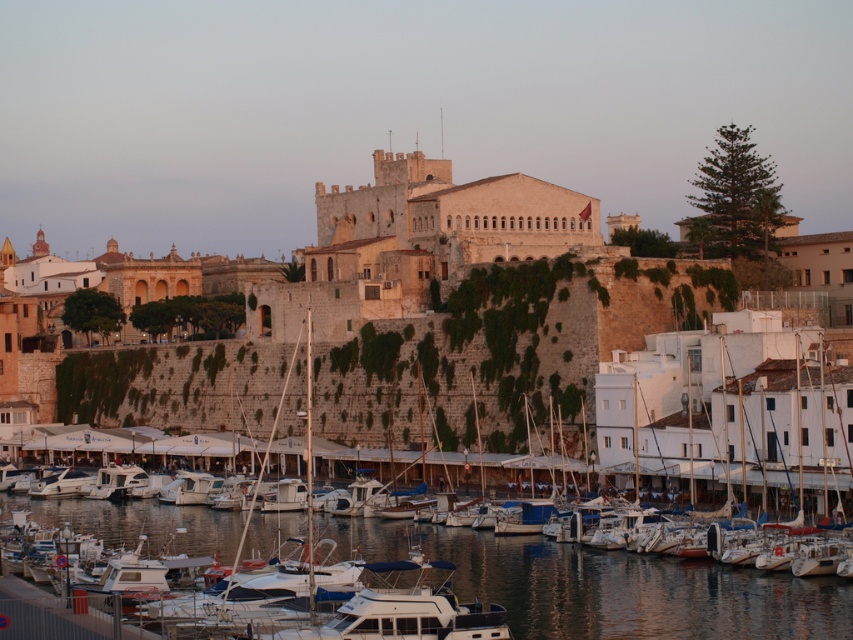
Can you confirm if stone wall at center is positioned to the left of clear water at lower center?

Correct, you'll find stone wall at center to the left of clear water at lower center.

Is stone wall at center bigger than clear water at lower center?

Correct, stone wall at center is larger in size than clear water at lower center.

Measure the distance between point (457, 358) and camera.

Point (457, 358) is 379.86 feet from camera.

Find the location of a particular element. The image size is (853, 640). stone wall at center is located at coordinates (399, 314).

Is point (227, 381) in front of point (646, 403)?

No, (227, 381) is further to viewer.

Is point (727, 454) behind point (646, 428)?

No, it is in front of (646, 428).

I want to click on stone wall at center, so click(399, 314).

Who is more distant from viewer, (x=763, y=449) or (x=612, y=605)?

The point (x=763, y=449) is more distant.

Is white matte sailboat at center in front of clear water at lower center?

No.

Between point (714, 340) and point (300, 520), which one is positioned in front?

Point (300, 520)

Locate an element on the screen. This screenshot has height=640, width=853. white matte sailboat at center is located at coordinates (724, 419).